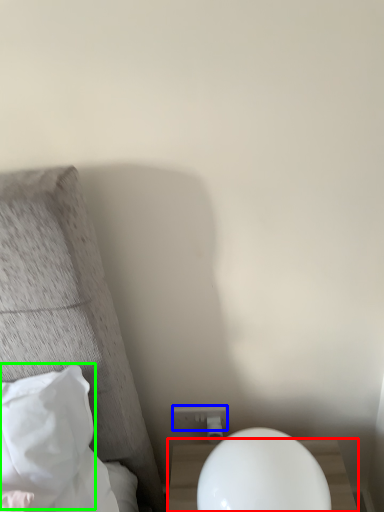
Question: Which is farther away from nightstand (highlighted by a red box)? electric outlet (highlighted by a blue box) or pillow (highlighted by a green box)?

Choices:
 (A) electric outlet
 (B) pillow

Answer: (B)